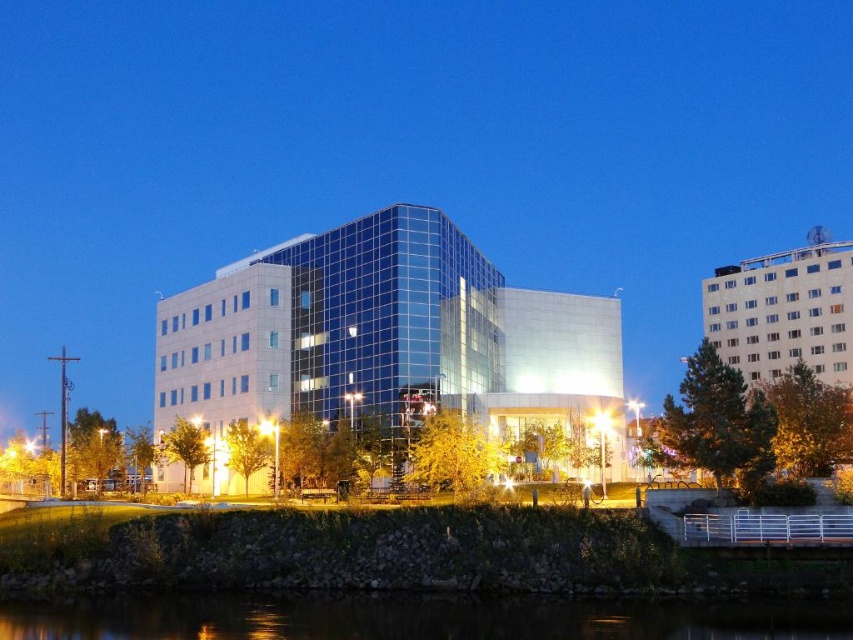
Question: Does glassy blue building at center have a smaller size compared to white textured building at upper right?

Choices:
 (A) yes
 (B) no

Answer: (A)

Question: Observing the image, what is the correct spatial positioning of glassy blue building at center in reference to transparent glass water at lower center?

Choices:
 (A) above
 (B) below

Answer: (A)

Question: Which object is closer to the camera taking this photo?

Choices:
 (A) transparent glass water at lower center
 (B) glassy blue building at center
 (C) white textured building at upper right

Answer: (A)

Question: From the image, what is the correct spatial relationship of transparent glass water at lower center in relation to white textured building at upper right?

Choices:
 (A) below
 (B) above

Answer: (A)

Question: Which object is farther from the camera taking this photo?

Choices:
 (A) white textured building at upper right
 (B) transparent glass water at lower center

Answer: (A)

Question: Among these objects, which one is nearest to the camera?

Choices:
 (A) white textured building at upper right
 (B) glassy blue building at center

Answer: (A)